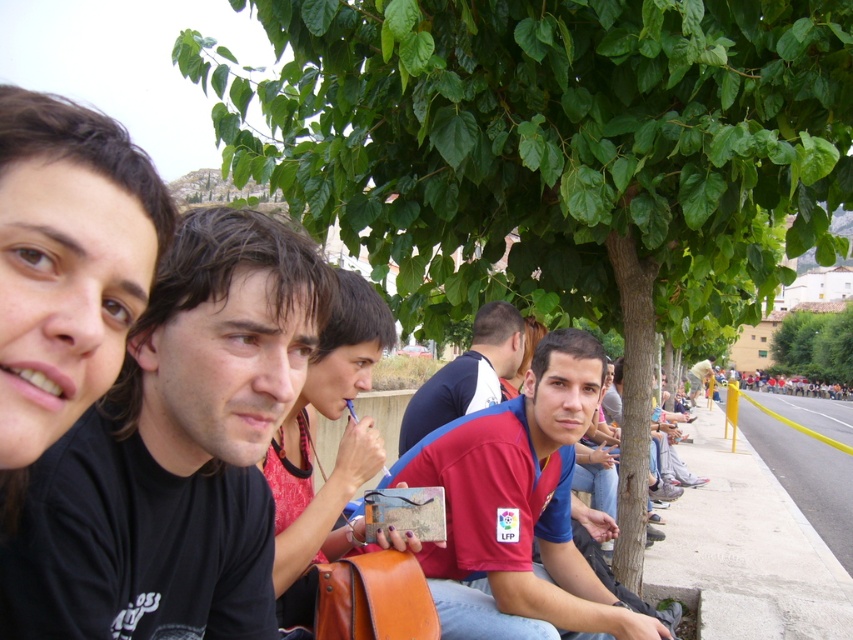
Question: Among these objects, which one is nearest to the camera?

Choices:
 (A) light brown leather jacket at center
 (B) matte brown guitar at center
 (C) blue fabric shirt at center
 (D) red fabric shirt at center

Answer: (B)

Question: Which point is closer to the camera?

Choices:
 (A) 532,448
 (B) 218,508
 (C) 344,396
 (D) 422,429

Answer: (B)

Question: Does red fabric shirt at center appear on the right side of blue fabric shirt at center?

Choices:
 (A) no
 (B) yes

Answer: (B)

Question: Which point is closer to the camera taking this photo?

Choices:
 (A) coord(689,371)
 (B) coord(421,474)
 (C) coord(808,323)

Answer: (B)

Question: Can you confirm if blue fabric shirt at center is wider than light brown leather jacket at center?

Choices:
 (A) yes
 (B) no

Answer: (B)

Question: Does red fabric shirt at center lie behind light brown leather jacket at center?

Choices:
 (A) yes
 (B) no

Answer: (B)